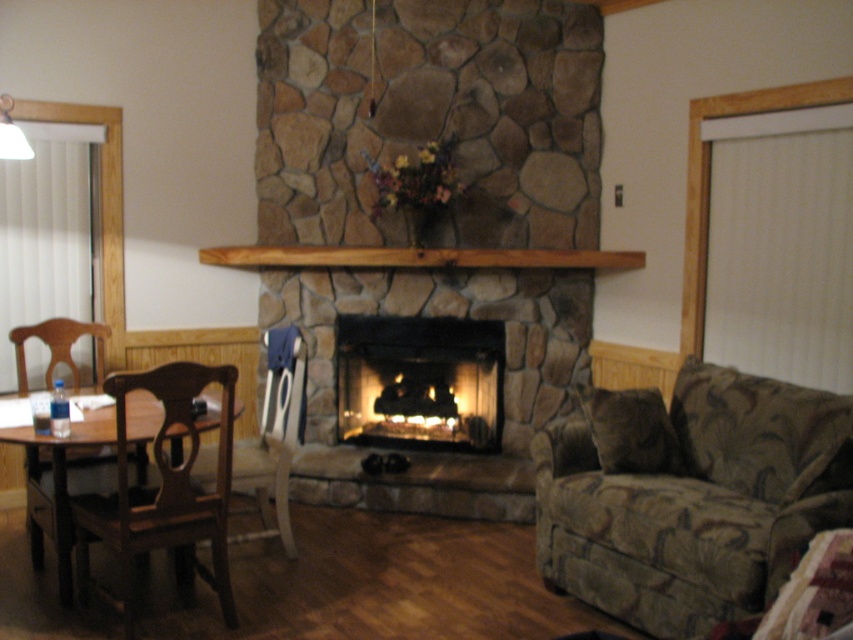
Can you confirm if brown floral fabric couch at lower right is smaller than brown wood mantle at center?

No, brown floral fabric couch at lower right is not smaller than brown wood mantle at center.

Can you confirm if brown floral fabric couch at lower right is taller than brown wood mantle at center?

Correct, brown floral fabric couch at lower right is much taller as brown wood mantle at center.

Between point (567, 518) and point (599, 256), which one is positioned behind?

Point (599, 256)

The height and width of the screenshot is (640, 853). In order to click on brown floral fabric couch at lower right in this screenshot , I will do `click(689, 496)`.

Can you confirm if velvet brown armchair at center is bigger than brown fabric chair at left?

Yes.

Is point (277, 349) closer to camera compared to point (55, 326)?

Yes, it is in front of point (55, 326).

Between point (264, 387) and point (83, 328), which one is positioned in front?

Positioned in front is point (83, 328).

At what (x,y) coordinates should I click in order to perform the action: click on velvet brown armchair at center. Please return your answer as a coordinate pair (x, y). Looking at the image, I should click on (274, 440).

Is velvet brown armchair at center behind brown wood mantle at center?

No.

Can you confirm if velvet brown armchair at center is shorter than brown wood mantle at center?

No, velvet brown armchair at center is not shorter than brown wood mantle at center.

I want to click on velvet brown armchair at center, so click(274, 440).